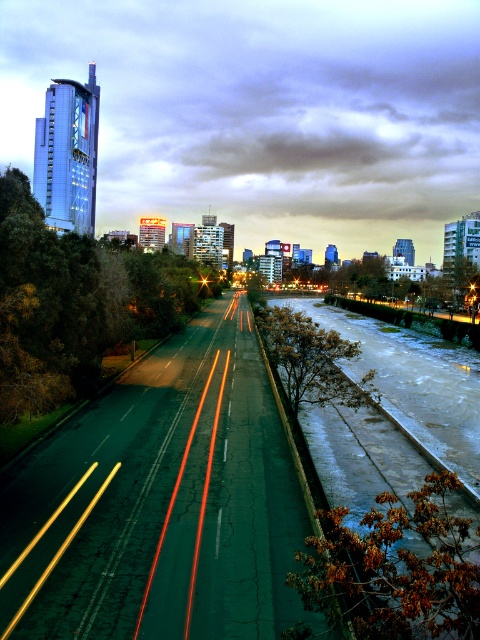
Looking at this image, is green asphalt highway at center positioned behind icy concrete river at center-right?

Yes, green asphalt highway at center is behind icy concrete river at center-right.

Is point (69, 554) positioned in front of point (377, 573)?

That is False.

Is point (260, 380) behind point (408, 557)?

Yes, it is behind point (408, 557).

Where is `green asphalt highway at center`? This screenshot has height=640, width=480. green asphalt highway at center is located at coordinates (168, 502).